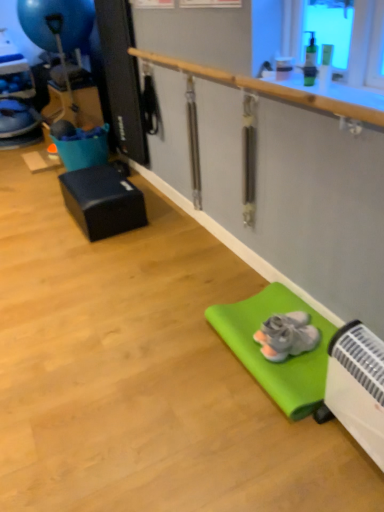
Question: Which is correct: black matte cube at left is inside wooden rail at upper center, or outside of it?

Choices:
 (A) outside
 (B) inside

Answer: (A)

Question: From a real-world perspective, is black matte cube at left physically located above or below wooden rail at upper center?

Choices:
 (A) above
 (B) below

Answer: (B)

Question: Which object is positioned closest to the blue rubber balloon at upper left?

Choices:
 (A) black matte cube at left
 (B) green rubber yoga mat at lower right
 (C) wooden rail at upper center
 (D) gray suede sneakers at lower right

Answer: (A)

Question: Estimate the real-world distances between objects in this image. Which object is closer to the green rubber yoga mat at lower right?

Choices:
 (A) wooden rail at upper center
 (B) black matte cube at left
 (C) blue rubber balloon at upper left
 (D) gray suede sneakers at lower right

Answer: (D)